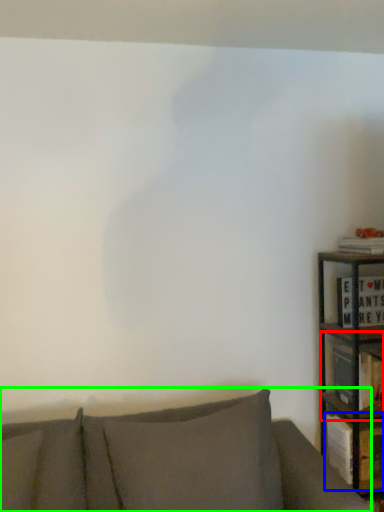
Question: Considering the real-world distances, which object is closest to shelf (highlighted by a red box)? book (highlighted by a blue box) or studio couch (highlighted by a green box).

Choices:
 (A) book
 (B) studio couch

Answer: (A)